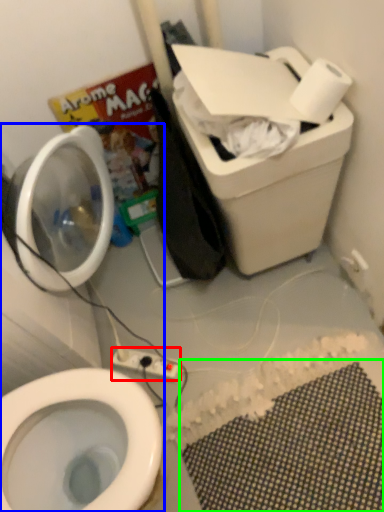
Question: Which is farther away from electric outlet (highlighted by a red box)? toiletries (highlighted by a blue box) or bath mat (highlighted by a green box)?

Choices:
 (A) toiletries
 (B) bath mat

Answer: (A)